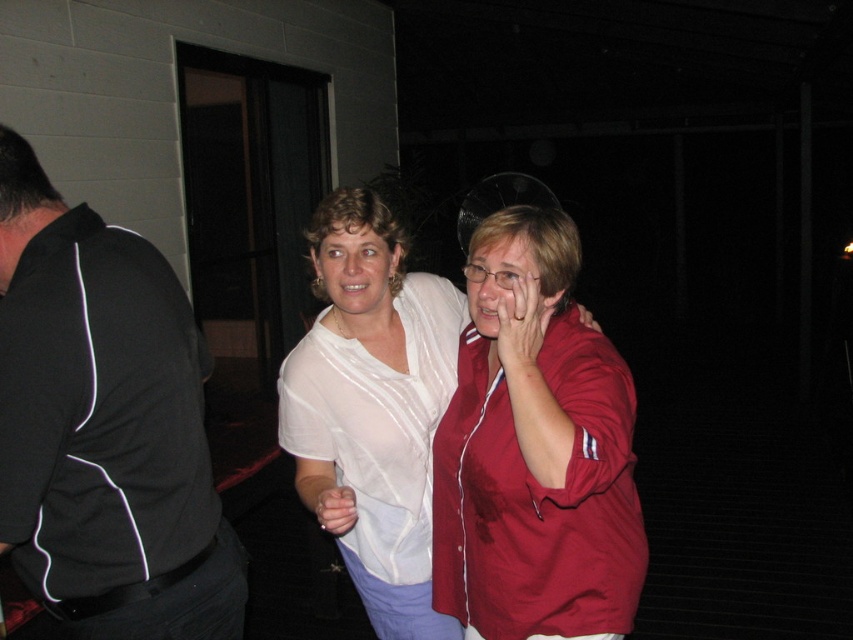
Does black fabric shirt at left appear on the right side of matte white hand at center?

In fact, black fabric shirt at left is to the left of matte white hand at center.

Who is shorter, black fabric shirt at left or matte white hand at center?

matte white hand at center

The width and height of the screenshot is (853, 640). Identify the location of black fabric shirt at left. (103, 426).

Can you confirm if black fabric shirt at left is positioned below matte white blouse at center?

No, black fabric shirt at left is not below matte white blouse at center.

Does point (61, 259) lie behind point (381, 340)?

No, (61, 259) is closer to viewer.

The height and width of the screenshot is (640, 853). I want to click on black fabric shirt at left, so click(x=103, y=426).

At what (x,y) coordinates should I click in order to perform the action: click on black fabric shirt at left. Please return your answer as a coordinate pair (x, y). Image resolution: width=853 pixels, height=640 pixels. Looking at the image, I should click on (103, 426).

Can you confirm if matte white blouse at center is thinner than matte red shirt at center?

Incorrect, matte white blouse at center's width is not less than matte red shirt at center's.

Which is in front, point (434, 621) or point (547, 323)?

Point (547, 323)

You are a GUI agent. You are given a task and a screenshot of the screen. Output one action in this format:
    pyautogui.click(x=<x>, y=<y>)
    Task: Click on the matte white blouse at center
    Image resolution: width=853 pixels, height=640 pixels.
    Given the screenshot: What is the action you would take?
    pyautogui.click(x=374, y=401)